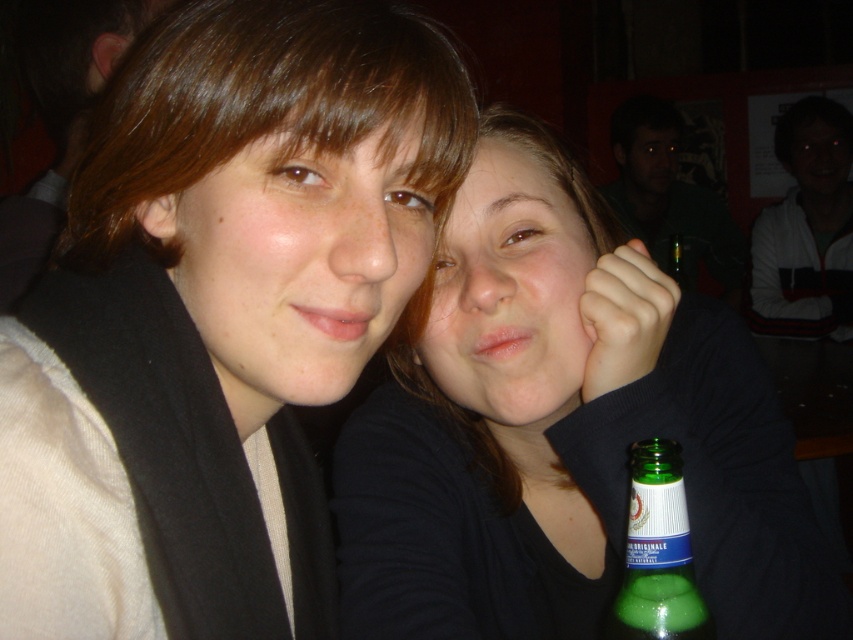
Question: Is matte black shirt at center wider than green glass bottle at upper right?

Choices:
 (A) yes
 (B) no

Answer: (B)

Question: Which is nearer to the matte black shirt at center?

Choices:
 (A) green glass bottle at lower center
 (B) green glass bottle at upper right

Answer: (A)

Question: Which point is closer to the camera?

Choices:
 (A) matte black scarf at upper left
 (B) green glass bottle at lower center
 (C) green glass bottle at upper right
 (D) matte black shirt at center

Answer: (A)

Question: Which of the following is the closest to the observer?

Choices:
 (A) green glass bottle at lower center
 (B) matte black scarf at upper left
 (C) green glass bottle at upper right

Answer: (B)

Question: Can you confirm if matte black shirt at center is thinner than green glass bottle at lower center?

Choices:
 (A) yes
 (B) no

Answer: (B)

Question: From the image, what is the correct spatial relationship of green glass bottle at upper right in relation to green glass bottle at lower center?

Choices:
 (A) right
 (B) left

Answer: (A)